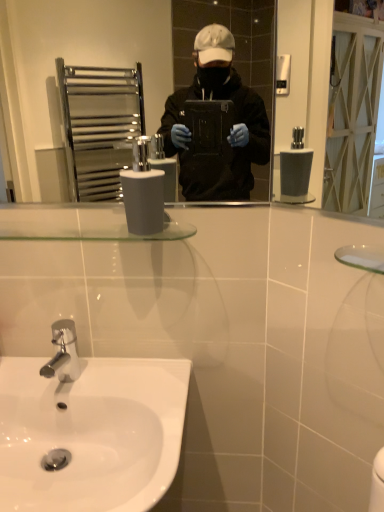
Question: Is point (125, 215) closer or farther from the camera than point (23, 375)?

Choices:
 (A) farther
 (B) closer

Answer: (B)

Question: From the image's perspective, is white matte toilet paper at center above or below white glossy sink at lower left?

Choices:
 (A) above
 (B) below

Answer: (A)

Question: In the image, is white matte toilet paper at center on the left side or the right side of white glossy sink at lower left?

Choices:
 (A) left
 (B) right

Answer: (B)

Question: From a real-world perspective, is white glossy sink at lower left positioned above or below white matte toilet paper at center?

Choices:
 (A) below
 (B) above

Answer: (A)

Question: From the image's perspective, is white glossy sink at lower left positioned above or below white matte toilet paper at center?

Choices:
 (A) below
 (B) above

Answer: (A)

Question: In terms of size, does white glossy sink at lower left appear bigger or smaller than white matte toilet paper at center?

Choices:
 (A) big
 (B) small

Answer: (A)

Question: Does point (150, 431) appear closer or farther from the camera than point (137, 223)?

Choices:
 (A) closer
 (B) farther

Answer: (B)